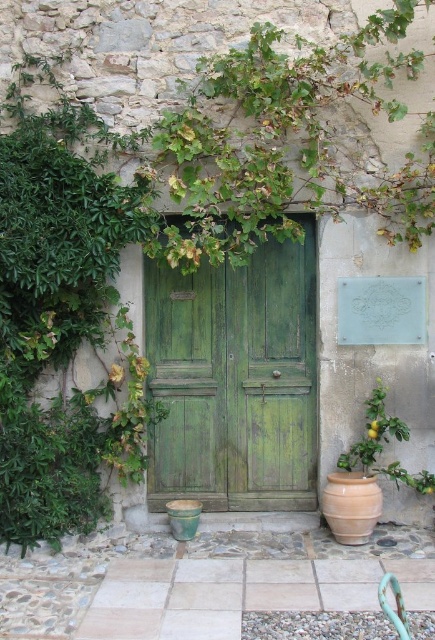
Question: In this image, where is green wooden door at center located relative to green matte plant at lower right?

Choices:
 (A) right
 (B) left

Answer: (B)

Question: In this image, where is green wooden door at center located relative to green matte plant at lower right?

Choices:
 (A) below
 (B) above

Answer: (B)

Question: Is green wooden door at center above green matte plant at lower right?

Choices:
 (A) yes
 (B) no

Answer: (A)

Question: Which object is farther from the camera taking this photo?

Choices:
 (A) green wooden door at center
 (B) green matte plant at lower right

Answer: (A)

Question: Which point is closer to the camera taking this photo?

Choices:
 (A) (190, 417)
 (B) (368, 472)

Answer: (B)